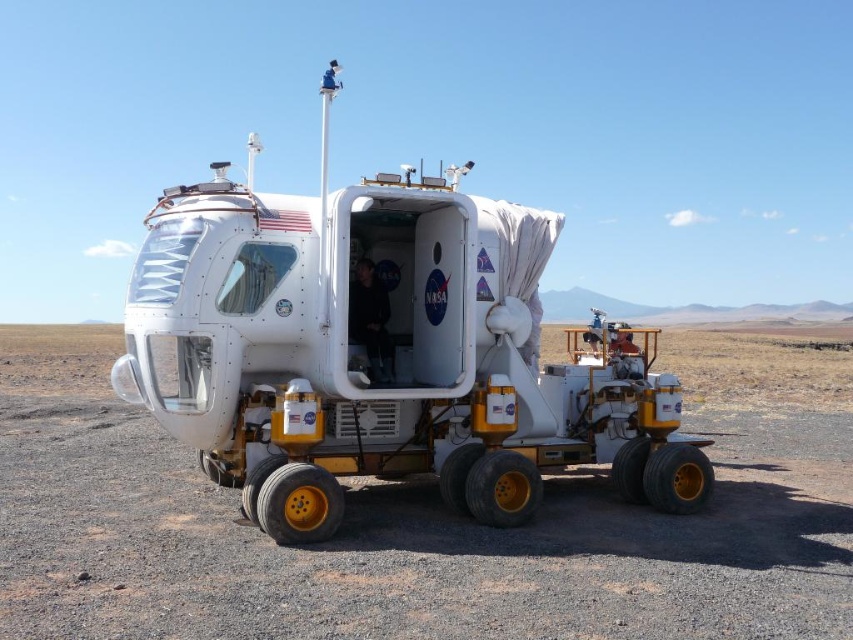
Question: Does dirt gravel at center appear on the right side of white matte rover at center?

Choices:
 (A) no
 (B) yes

Answer: (B)

Question: Is dirt gravel at center closer to camera compared to white matte rover at center?

Choices:
 (A) no
 (B) yes

Answer: (B)

Question: Which point is closer to the camera?

Choices:
 (A) white matte rover at center
 (B) dirt gravel at center

Answer: (B)

Question: Which of the following is the closest to the observer?

Choices:
 (A) white matte rover at center
 (B) dirt gravel at center

Answer: (B)

Question: Is dirt gravel at center wider than white matte rover at center?

Choices:
 (A) no
 (B) yes

Answer: (B)